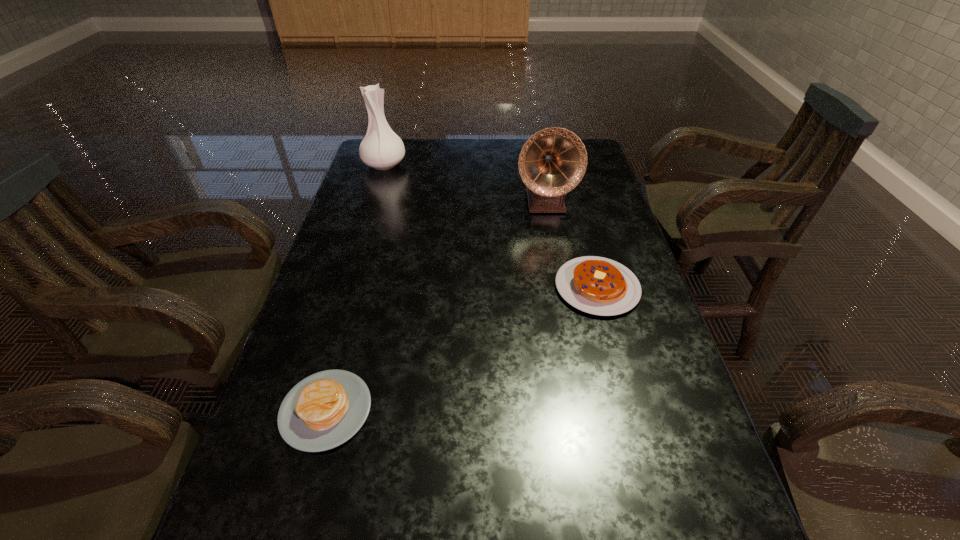
Where is `the farthest object`? This screenshot has height=540, width=960. the farthest object is located at coordinates (381, 148).

Locate an element on the screen. phonograph record is located at coordinates (552, 162).

Identify the location of the left pancake. (324, 410).

The image size is (960, 540). I want to click on the nearer pancake, so click(x=324, y=410).

Locate an element on the screen. the farther pancake is located at coordinates (600, 286).

Locate an element on the screen. This screenshot has height=540, width=960. the third farthest object is located at coordinates (600, 286).

The height and width of the screenshot is (540, 960). Find the location of `vacant area situated 0.090m on the front of the vase`. vacant area situated 0.090m on the front of the vase is located at coordinates (376, 190).

At what (x,y) coordinates should I click in order to perform the action: click on free spot located on the horn of the second farthest object. Please return your answer as a coordinate pair (x, y). Looking at the image, I should click on (556, 261).

Locate an element on the screen. The width and height of the screenshot is (960, 540). vacant space located 0.150m on the back of the nearer pancake is located at coordinates (351, 319).

You are a GUI agent. You are given a task and a screenshot of the screen. Output one action in this format:
    pyautogui.click(x=<x>, y=<y>)
    Task: Click on the vacant point located on the front of the right pancake
    This screenshot has width=960, height=540.
    Given the screenshot: What is the action you would take?
    pyautogui.click(x=636, y=429)